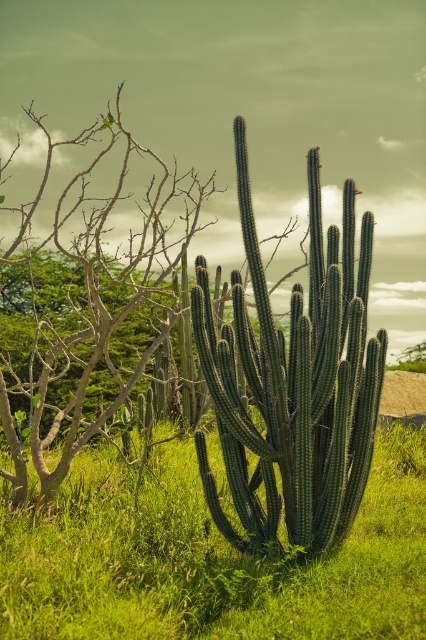
Question: Which object appears closest to the camera in this image?

Choices:
 (A) green spiny cactus at center
 (B) green matte tree at center
 (C) green matte cactus at center

Answer: (A)

Question: Which point is closer to the camera taking this photo?

Choices:
 (A) (5, 586)
 (B) (52, 404)
 (C) (233, 330)

Answer: (A)

Question: In this image, where is green spiny cactus at center located relative to green matte tree at center?

Choices:
 (A) right
 (B) left

Answer: (A)

Question: Estimate the real-world distances between objects in this image. Which object is closer to the green matte cactus at center?

Choices:
 (A) green matte tree at center
 (B) green spiny cactus at center

Answer: (B)

Question: Does green matte cactus at center have a greater width compared to green spiny cactus at center?

Choices:
 (A) yes
 (B) no

Answer: (B)

Question: Is green matte cactus at center thinner than green spiny cactus at center?

Choices:
 (A) no
 (B) yes

Answer: (B)